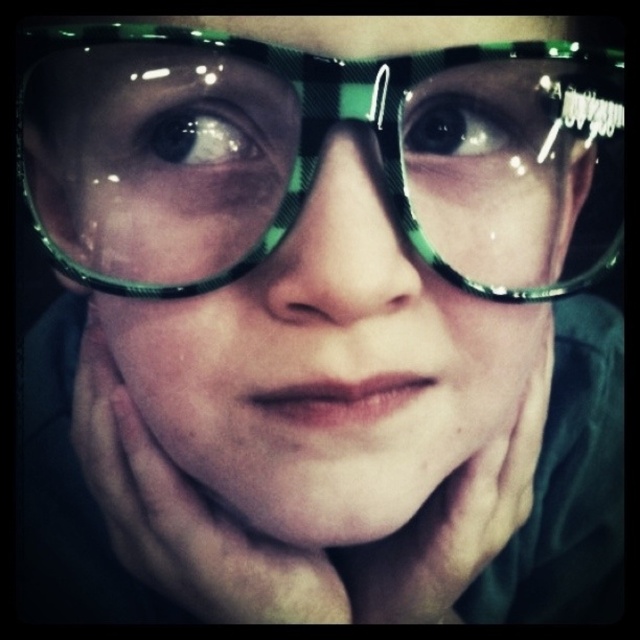
You are a photographer adjusting your camera to focus on the subject in the image. You notice the green shiny glasses at center and the black glossy eye at center. Which object should you focus on first if you want to ensure the closest object is sharp?

The green shiny glasses at center is closer to the viewer than the black glossy eye at center, so you should focus on the green shiny glasses at center first to ensure the closest object is sharp.

Based on the scene description, which object is taller between the green plastic glasses at center and the black glossy eye at center?

The green plastic glasses at center is much taller than the black glossy eye at center according to the description.

Consider the image. You are an artist trying to sketch this portrait. You need to decide which object should be drawn first based on their position. According to the image, which is closer to you, the green shiny glasses at center or the brown glossy eye at upper left?

The green shiny glasses at center is closer to the viewer than the brown glossy eye at upper left, so you should draw the green shiny glasses at center first.